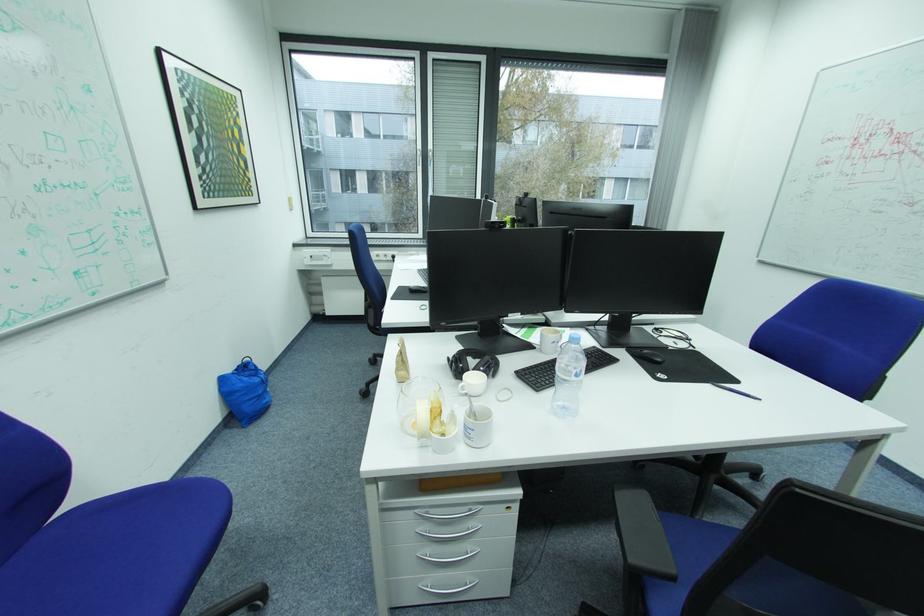
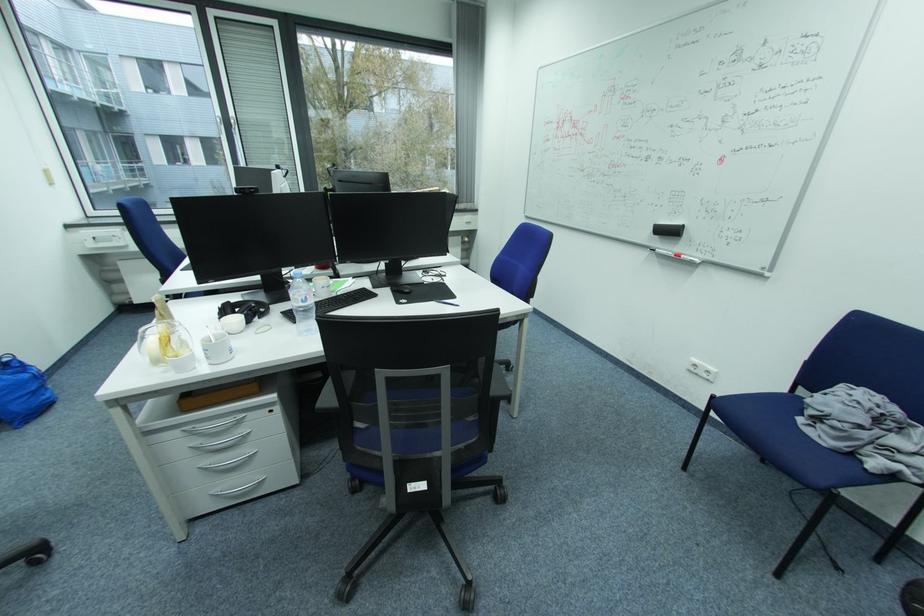
The point at (440, 589) is marked in the first image. Where is the corresponding point in the second image?

(229, 493)